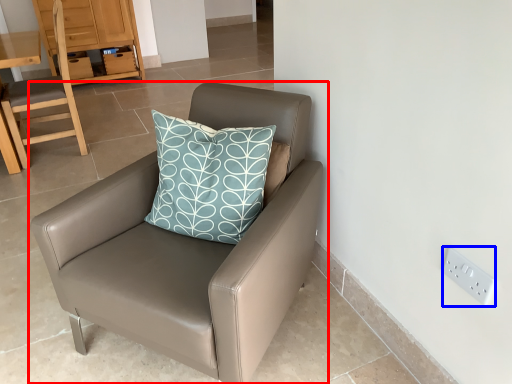
Question: Which point is closer to the camera, chair (highlighted by a red box) or electric outlet (highlighted by a blue box)?

Choices:
 (A) chair
 (B) electric outlet

Answer: (A)